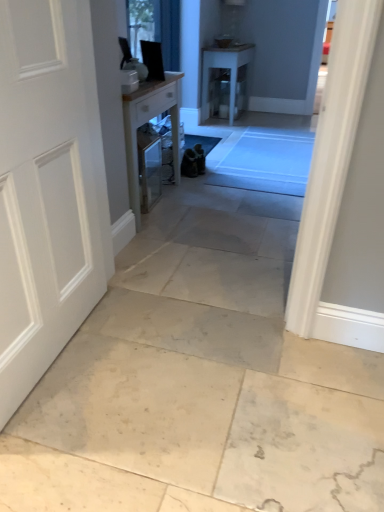
Find the location of a particular element. The height and width of the screenshot is (512, 384). free space to the right of white glossy table at center, which is counted as the 1th table, starting from the right is located at coordinates (268, 121).